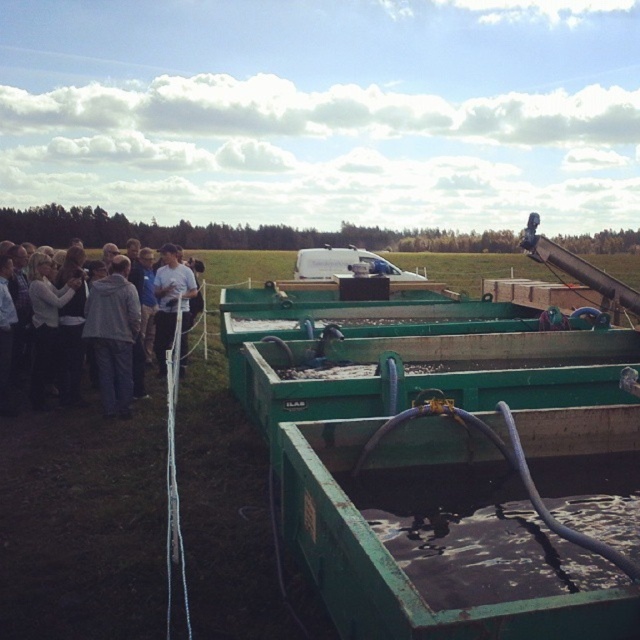
Question: Among these points, which one is farthest from the camera?

Choices:
 (A) (56, 332)
 (B) (182, 285)
 (C) (99, 298)

Answer: (B)

Question: Which of the following is the closest to the observer?

Choices:
 (A) (182, 300)
 (B) (36, 280)
 (C) (120, 348)

Answer: (C)

Question: Can you confirm if light gray hoodie at left is positioned above white matte shirt at center?

Choices:
 (A) no
 (B) yes

Answer: (A)

Question: Which of the following is the farthest from the observer?

Choices:
 (A) light gray hoodie at left
 (B) gray fabric jacket at left
 (C) white matte shirt at center

Answer: (C)

Question: Can you confirm if light gray hoodie at left is smaller than gray fabric jacket at left?

Choices:
 (A) yes
 (B) no

Answer: (B)

Question: Is gray fabric jacket at left closer to camera compared to white matte shirt at center?

Choices:
 (A) no
 (B) yes

Answer: (B)